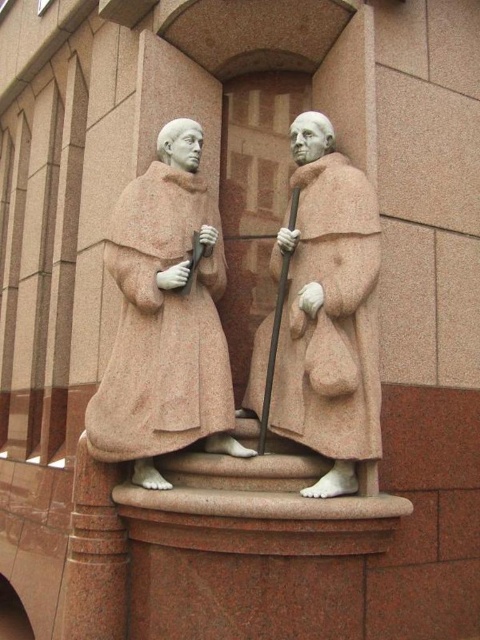
You are an art student analyzing the sculpture of two monks. You notice the rustic stone robe at center and the pink stone robe at center. Which robe is located to the left of the other?

The rustic stone robe at center is positioned on the left side of pink stone robe at center.

You are an art conservator examining the stone sculpture of two monks. You notice two robes depicted in the sculpture, a rustic stone robe at center and a pink stone robe at center. Which robe appears wider?

The rustic stone robe at center is wider than the pink stone robe at center.

You are an art conservator tasked with measuring the space between two stone sculptures in a gallery. The sculptures are labeled as rustic stone robe at center and pink stone robe at center. The gallery requires a minimum clearance of 24 inches between displayed artworks. Can you confirm if the current spacing meets the requirement?

The distance between rustic stone robe at center and pink stone robe at center is 24.27 inches, which exceeds the required 24 inches clearance. Therefore, the current spacing meets the gallery requirement.